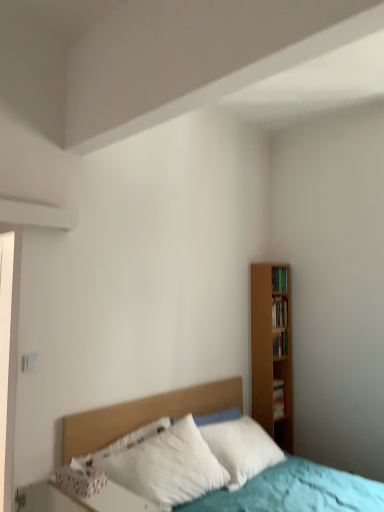
Question: Does point (286, 351) appear closer or farther from the camera than point (127, 421)?

Choices:
 (A) farther
 (B) closer

Answer: (A)

Question: Is wooden bookshelf at right, placed as the second book when sorted from bottom to top, in front of or behind wooden headboard at center in the image?

Choices:
 (A) behind
 (B) front

Answer: (A)

Question: Which of these objects is positioned closest to the wooden bookshelf at right, which is the 4th book in bottom-to-top order?

Choices:
 (A) hardcover book at right, the 4th book from the top
 (B) wooden bookshelf at right, marked as the 3th book in a bottom-to-top arrangement
 (C) wooden headboard at center
 (D) wooden bookshelf at right, which is counted as the 3th book, starting from the top

Answer: (B)

Question: Which is nearer to the wooden headboard at center?

Choices:
 (A) wooden bookshelf at right, placed as the second book when sorted from bottom to top
 (B) wooden bookshelf at right, marked as the 3th book in a bottom-to-top arrangement
 (C) hardcover book at right, the first book in the bottom-to-top sequence
 (D) wooden bookshelf at right, the 1th book when ordered from top to bottom

Answer: (C)